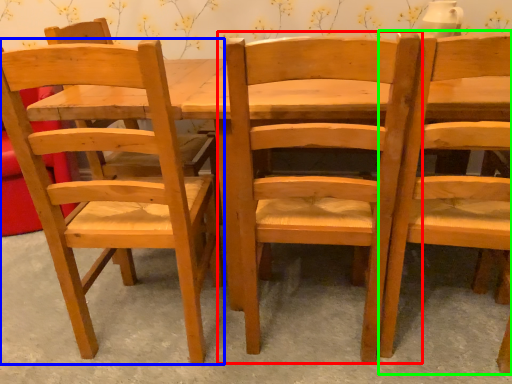
Question: Which object is positioned closest to chair (highlighted by a red box)? Select from chair (highlighted by a blue box) and chair (highlighted by a green box).

Choices:
 (A) chair
 (B) chair

Answer: (B)